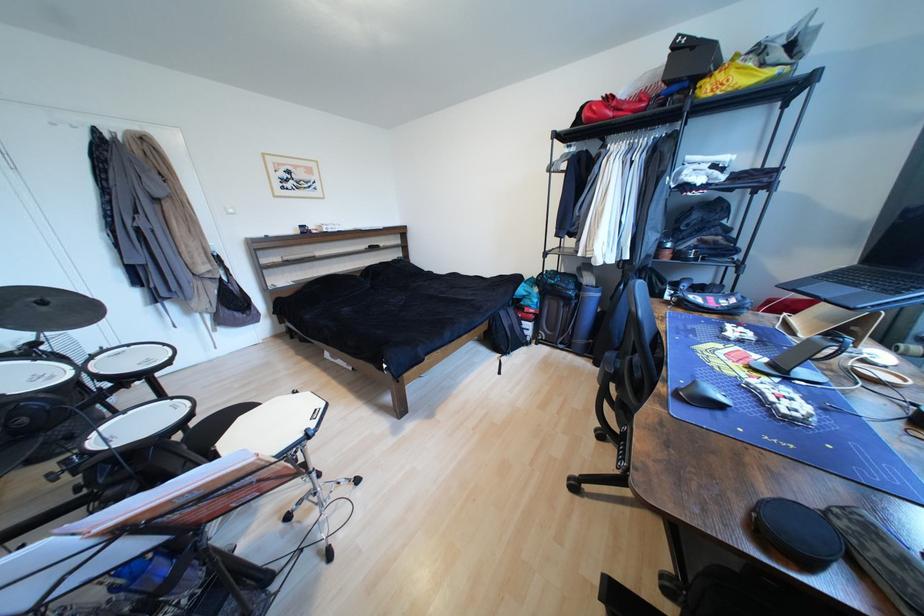
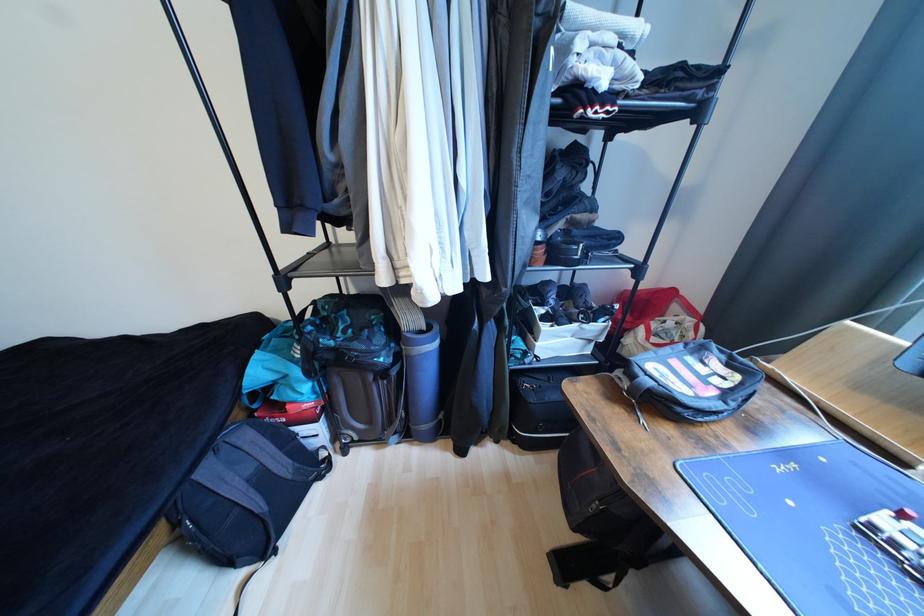
Where in the second image is the point corresponding to [508,315] from the first image?

(215, 472)